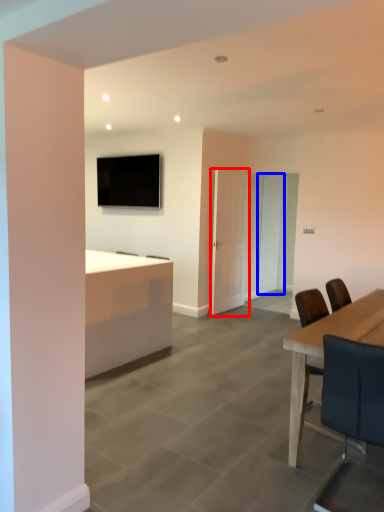
Question: Among these objects, which one is farthest to the camera, door (highlighted by a red box) or glass door (highlighted by a blue box)?

Choices:
 (A) door
 (B) glass door

Answer: (B)